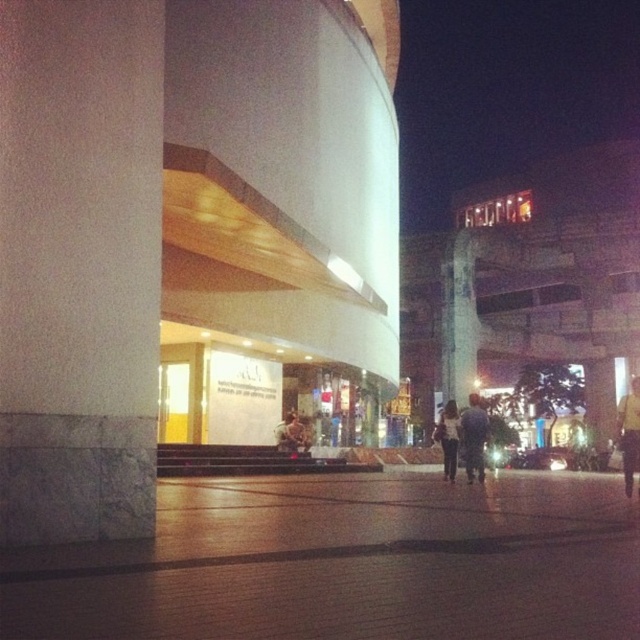
Is brown brick pavement at center smaller than white matte shirt at center?

Correct, brown brick pavement at center occupies less space than white matte shirt at center.

Can you confirm if brown brick pavement at center is positioned below white matte shirt at center?

No.

Which is in front, point (1, 634) or point (445, 468)?

Point (1, 634)

Locate an element on the screen. This screenshot has height=640, width=640. brown brick pavement at center is located at coordinates (348, 563).

Describe the element at coordinates (348, 563) in the screenshot. This screenshot has width=640, height=640. I see `brown brick pavement at center` at that location.

Is brown brick pavement at center wider than dark blue jeans at center?

Indeed, brown brick pavement at center has a greater width compared to dark blue jeans at center.

The image size is (640, 640). In order to click on brown brick pavement at center in this screenshot , I will do `click(348, 563)`.

Where is `brown brick pavement at center`? This screenshot has height=640, width=640. brown brick pavement at center is located at coordinates (348, 563).

Who is lower down, white marble pillar at left or light brown leather jacket at center?

light brown leather jacket at center

Which is behind, point (51, 156) or point (280, 432)?

Positioned behind is point (280, 432).

Is point (99, 362) behind point (308, 445)?

No.

This screenshot has height=640, width=640. I want to click on white marble pillar at left, so click(80, 266).